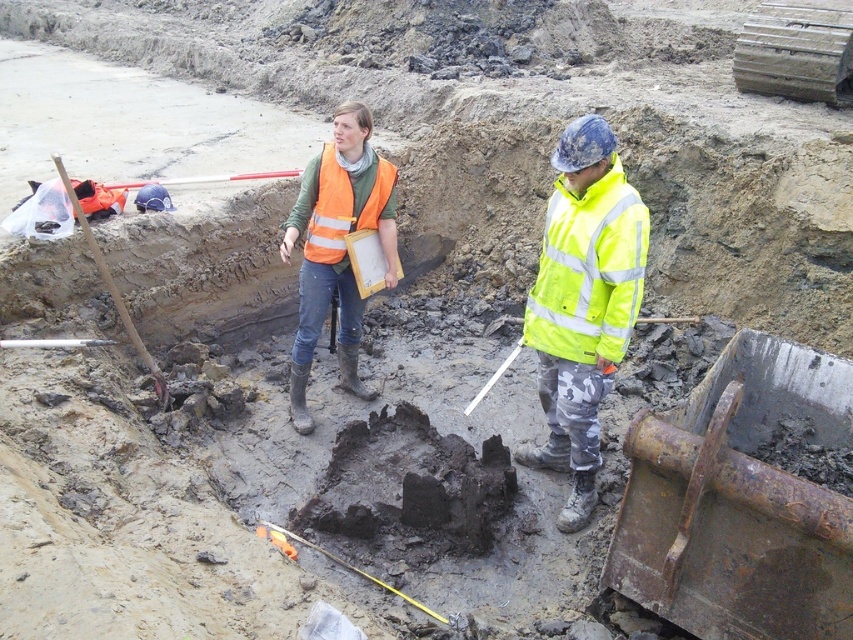
Is reflective orange vest at center below wooden shovel at left?

Yes.

Can you confirm if reflective orange vest at center is positioned above wooden shovel at left?

No.

I want to click on reflective orange vest at center, so click(x=337, y=246).

Is yellow reflective jacket at right bigger than wooden shovel at left?

Incorrect, yellow reflective jacket at right is not larger than wooden shovel at left.

What do you see at coordinates (583, 304) in the screenshot?
I see `yellow reflective jacket at right` at bounding box center [583, 304].

Locate an element on the screen. This screenshot has height=640, width=853. yellow reflective jacket at right is located at coordinates (583, 304).

Does high-visibility orange safety vest at center have a lesser width compared to wooden shovel at left?

Correct, high-visibility orange safety vest at center's width is less than wooden shovel at left's.

Is high-visibility orange safety vest at center to the right of wooden shovel at left from the viewer's perspective?

Yes, high-visibility orange safety vest at center is to the right of wooden shovel at left.

Locate an element on the screen. high-visibility orange safety vest at center is located at coordinates (343, 205).